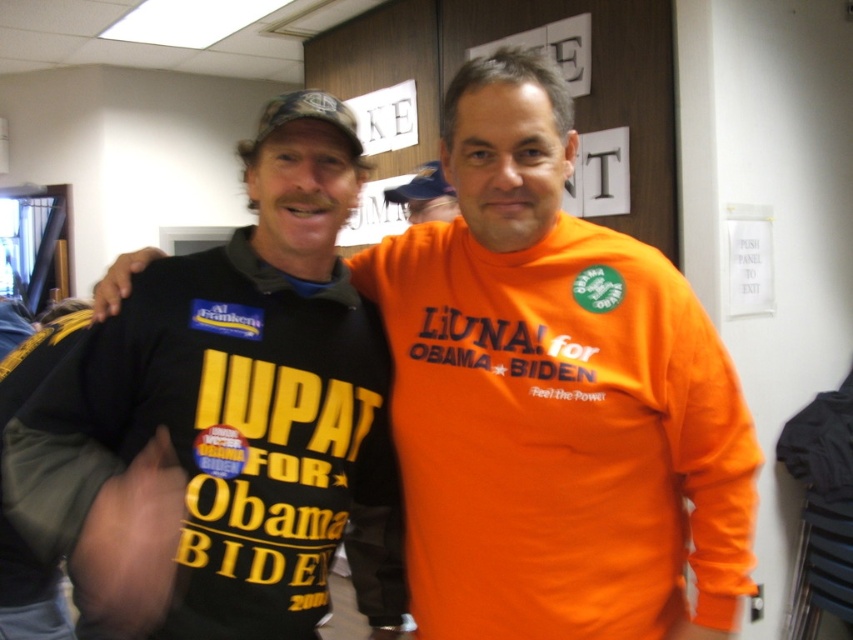
Does matte black t-shirt at left appear under orange t-shirt at center?

Correct, matte black t-shirt at left is located below orange t-shirt at center.

Consider the image. Is matte black t-shirt at left above orange t-shirt at center?

No, matte black t-shirt at left is not above orange t-shirt at center.

Is point (268, 164) behind point (432, 202)?

That is False.

Where is `matte black t-shirt at left`? This screenshot has width=853, height=640. matte black t-shirt at left is located at coordinates click(219, 413).

From the picture: Is matte black t-shirt at center positioned in front of orange t-shirt at center?

That is True.

Does matte black t-shirt at center have a greater height compared to orange t-shirt at center?

Indeed, matte black t-shirt at center has a greater height compared to orange t-shirt at center.

Between point (622, 445) and point (440, 218), which one is positioned behind?

Positioned behind is point (440, 218).

Find the location of a particular element. Image resolution: width=853 pixels, height=640 pixels. matte black t-shirt at center is located at coordinates (555, 397).

Is matte black t-shirt at center bigger than matte black t-shirt at left?

Yes.

Which is behind, point (730, 598) or point (305, 595)?

The point (730, 598) is more distant.

Who is more forward, (503,124) or (242,529)?

Point (503,124) is in front.

In order to click on matte black t-shirt at center in this screenshot , I will do `click(555, 397)`.